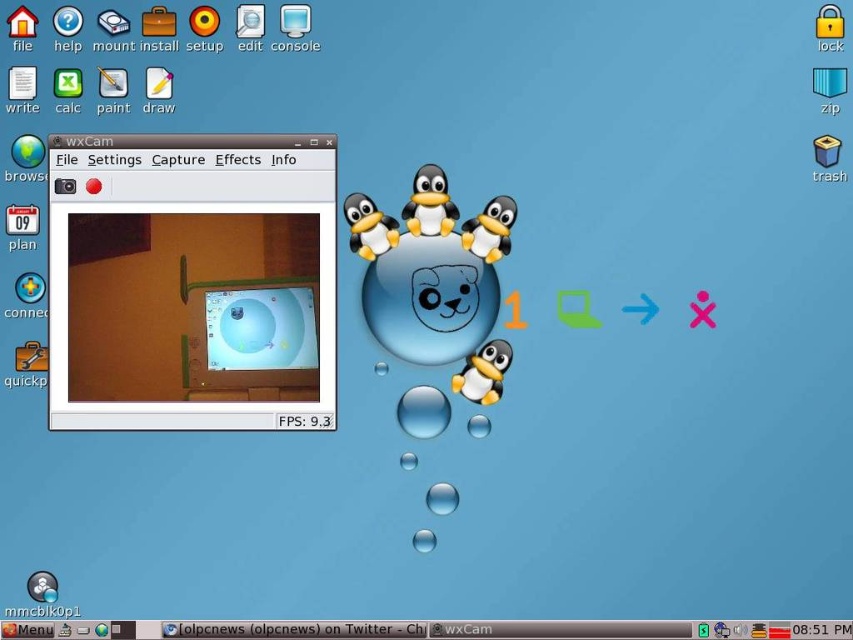
From the picture: You are looking at the computer desktop screen. There are two points marked on the screen at coordinates point (59, 419) and point (422, 417). Which point appears closer to you?

Point (59, 419) is closer to the camera than point (422, 417), so it appears closer to you.

You are setting up a new computer desk and want to place a matte black monitor at left and a transparent glass bubble at center on your desk. Based on the image, which object occupies more horizontal space on the desk?

The matte black monitor at left might be wider than transparent glass bubble at center, so it likely occupies more horizontal space on the desk.

You are organizing a display of penguins on your desk. You have a white matte penguin at upper center and a matte plastic penguin at center. Which penguin takes up more vertical space in the display?

The white matte penguin at upper center takes up more vertical space because it is much taller than the matte plastic penguin at center.